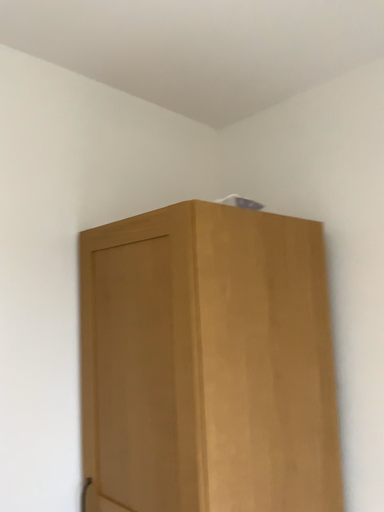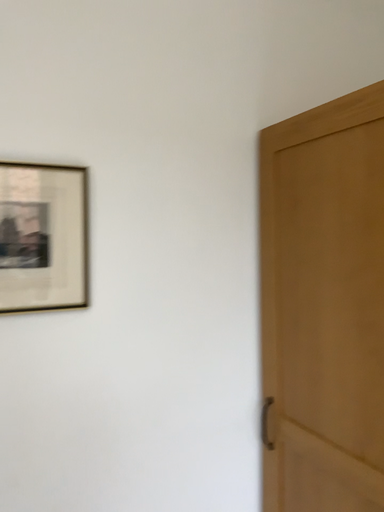
Question: Which way did the camera rotate in the video?

Choices:
 (A) rotated upward
 (B) rotated downward

Answer: (B)